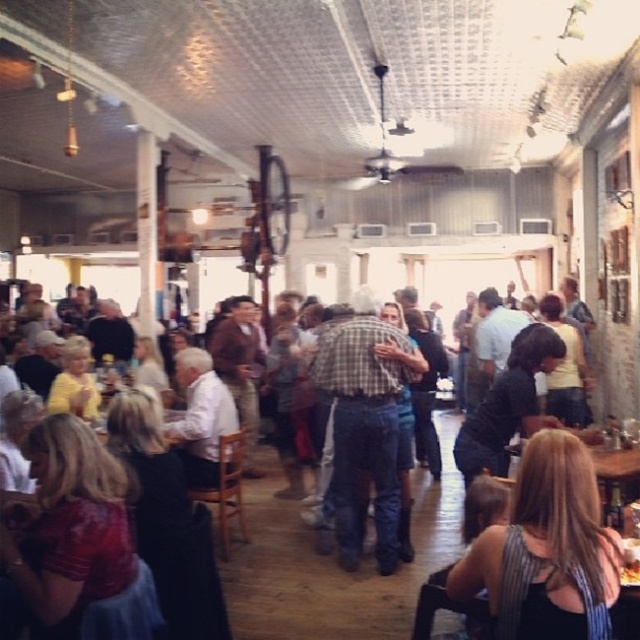
Does point (522, 547) lie in front of point (392, 452)?

Yes, point (522, 547) is in front of point (392, 452).

Looking at this image, between black striped tank top at lower right and plaid shirt at center, which one appears on the left side from the viewer's perspective?

plaid shirt at center

Image resolution: width=640 pixels, height=640 pixels. In order to click on black striped tank top at lower right in this screenshot , I will do click(547, 548).